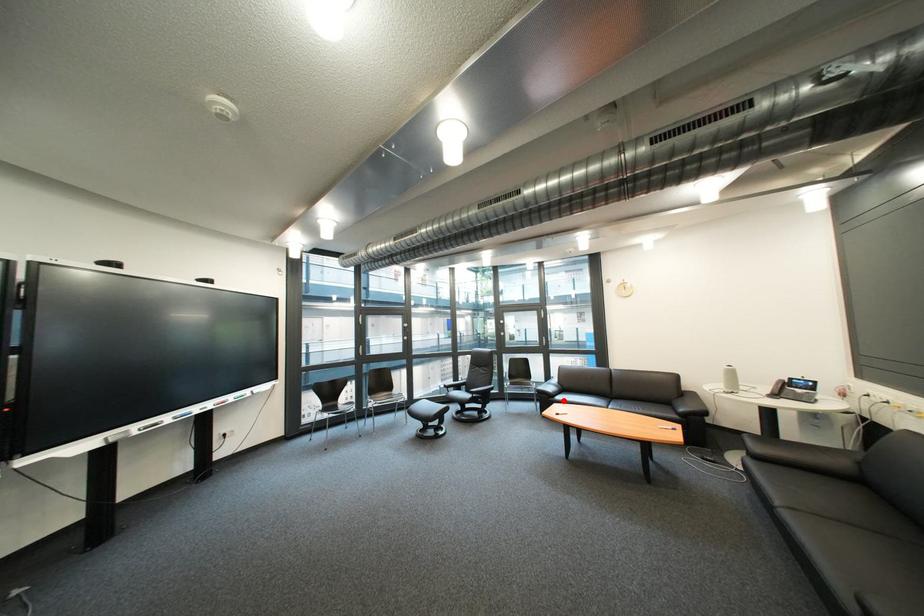
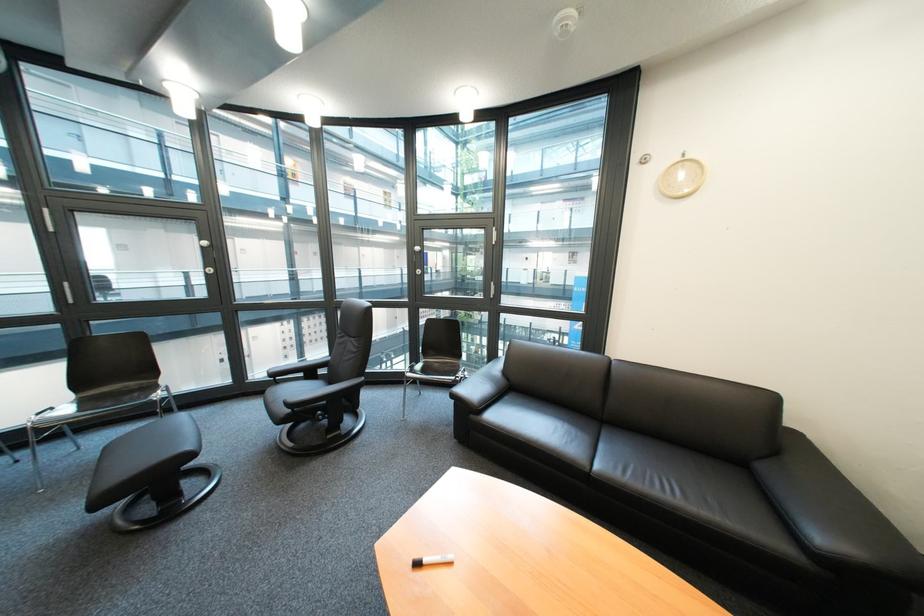
The point at the highlighted location is marked in the first image. Where is the corresponding point in the second image?

(485, 418)